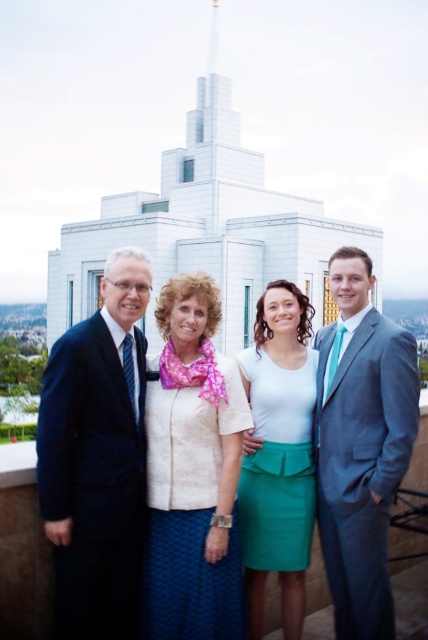
Question: Does dark blue suit at left have a greater width compared to white matte shirt at center?

Choices:
 (A) yes
 (B) no

Answer: (A)

Question: Which object is the farthest from the gray suit at right?

Choices:
 (A) matte black suit at left
 (B) dark blue suit at left
 (C) white textured blouse at center
 (D) white matte shirt at center

Answer: (B)

Question: From the image, what is the correct spatial relationship of white textured blouse at center in relation to gray suit at right?

Choices:
 (A) below
 (B) above

Answer: (A)

Question: Can you confirm if white textured blouse at center is positioned to the right of gray suit at right?

Choices:
 (A) no
 (B) yes

Answer: (A)

Question: Which point is closer to the camera?

Choices:
 (A) (389, 324)
 (B) (70, 406)
 (C) (308, 397)

Answer: (B)

Question: Estimate the real-world distances between objects in this image. Which object is farther from the matte black suit at left?

Choices:
 (A) gray suit at right
 (B) dark blue suit at left
 (C) white textured blouse at center
 (D) white matte shirt at center

Answer: (A)